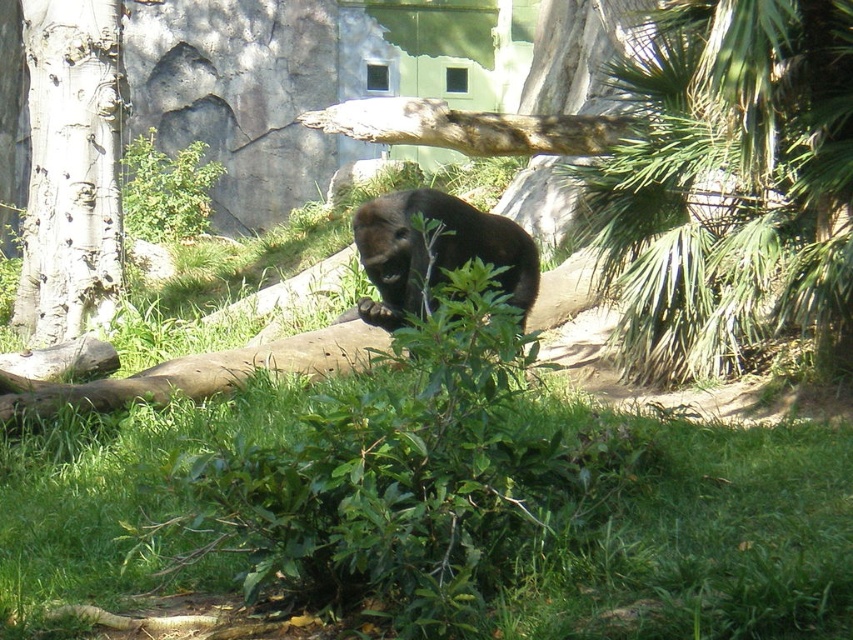
You are a zookeeper observing the gorilla enclosure. You notice the green leafy tree at upper right and the smooth gray bark at left. Which object is shorter?

The green leafy tree at upper right is shorter than the smooth gray bark at left.

You are standing in front of the gorilla enclosure and notice two points marked on the ground. The first point is at coordinates point (682,42) and the second is at point (106,161). Which point is closer to you?

Point (682,42) is closer to the viewer than point (106,161).

You are a zookeeper trying to determine the best path to approach the brown furry bear at center without disturbing it. Considering the green leafy bush at upper left, which object is closer to you and might block your view?

The green leafy bush at upper left is larger in size compared to the brown furry bear at center, so it might block your view more effectively if positioned between you and the bear.